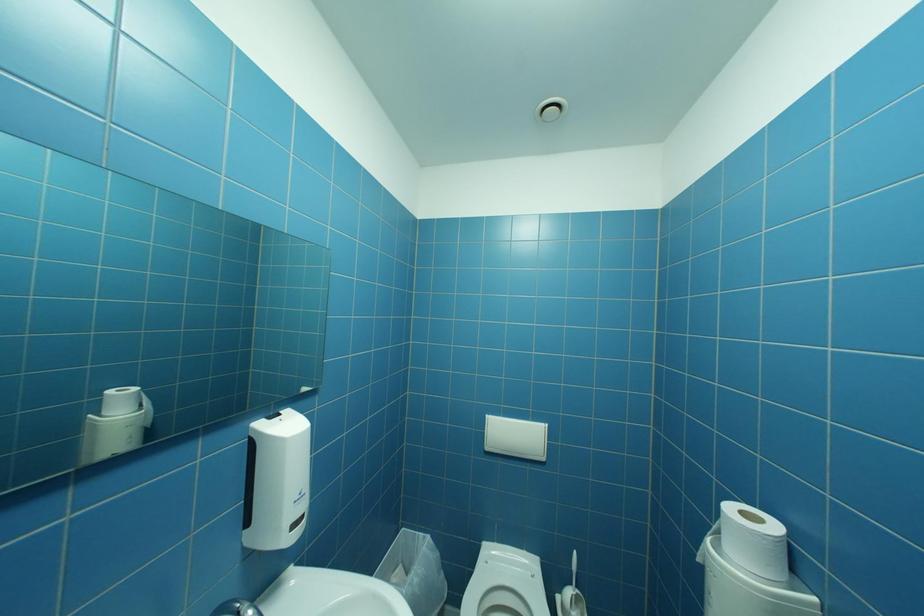
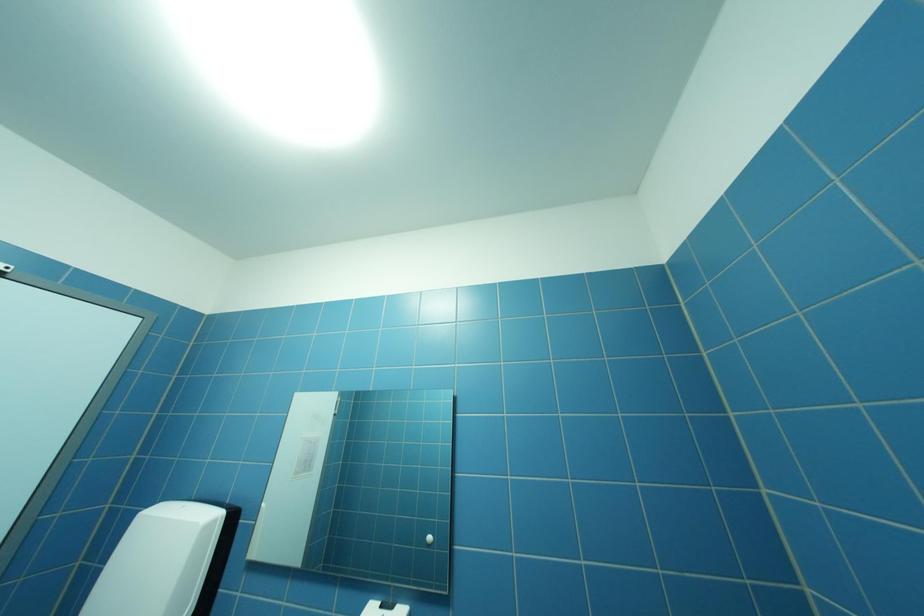
How did the camera likely rotate?

The rotation direction of the camera is left-up.